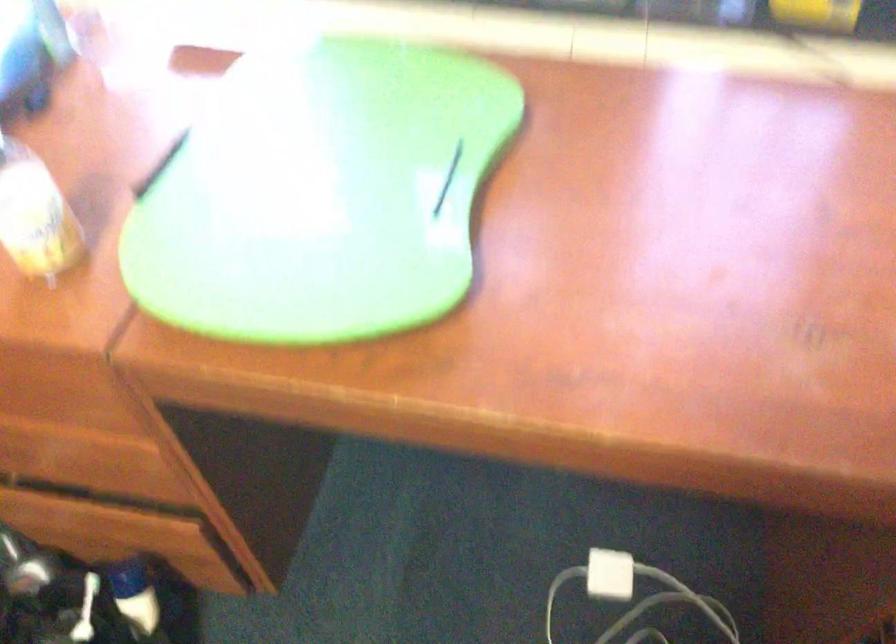
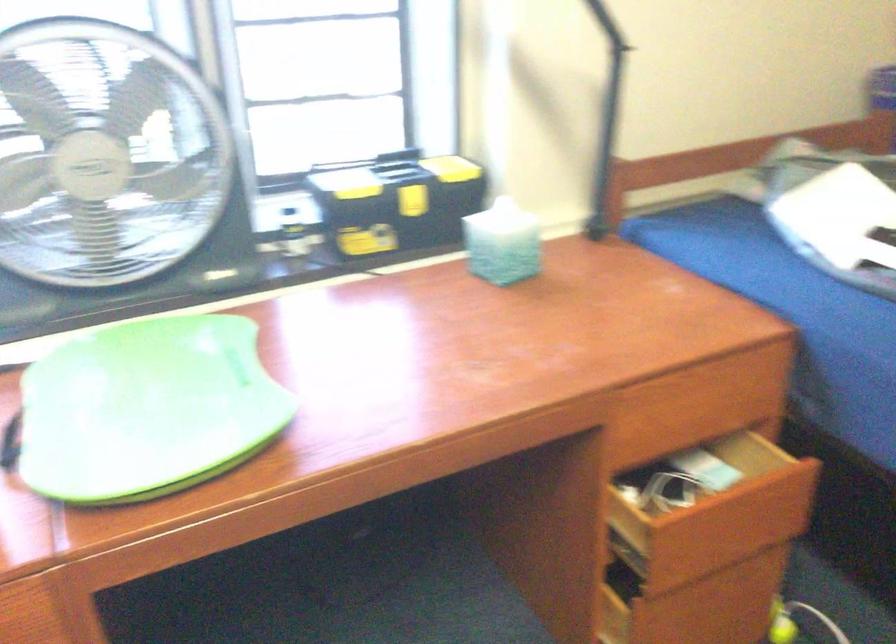
The point at (309, 202) is marked in the first image. Where is the corresponding point in the second image?

(147, 409)